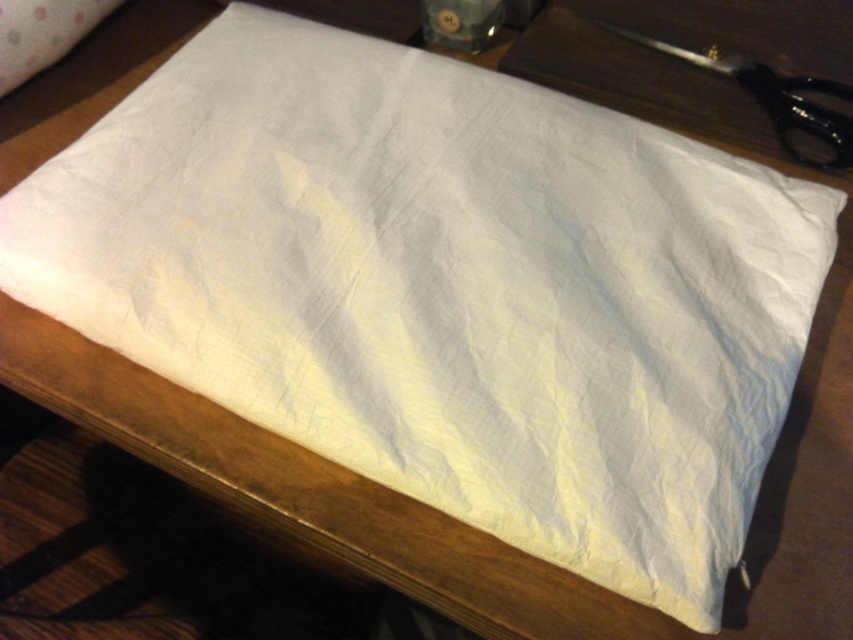
You are standing 1 meter away from the wooden surface where the white fabric is laid out. There is a specific point at coordinates point (827, 108) on the fabric. Can you reach that point without moving closer to the surface?

The distance of point (827, 108) from viewer is 1.01 meters, so you are currently 1 meter away from the wooden surface. Since the point is 1.01 meters away, it is slightly farther than your current position. Therefore, you cannot reach it without moving closer.

You are an artist trying to place a 10 cm wide paintbrush on the wooden surface. The black plastic scissors at upper right are already on the table. Where should you place the paintbrush so it doesn not overlap with the scissors?

The black plastic scissors at upper right are located at point (770,97). To avoid overlapping, place the paintbrush away from this area, preferably in an open space on the wooden surface not occupied by the scissors.